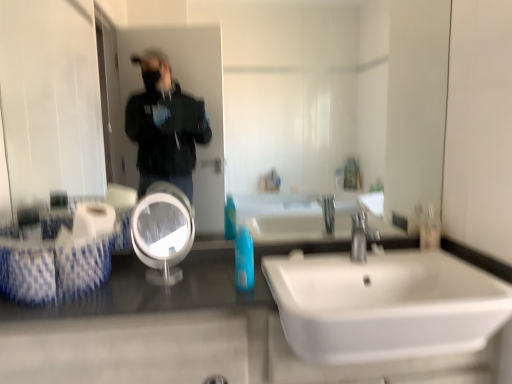
Question: From the image's perspective, does shiny granite counter at lower left appear higher than white ceramic sink at lower right?

Choices:
 (A) yes
 (B) no

Answer: (B)

Question: Is shiny granite counter at lower left positioned with its back to white ceramic sink at lower right?

Choices:
 (A) no
 (B) yes

Answer: (B)

Question: Is shiny granite counter at lower left thinner than white ceramic sink at lower right?

Choices:
 (A) no
 (B) yes

Answer: (B)

Question: From a real-world perspective, is shiny granite counter at lower left physically above white ceramic sink at lower right?

Choices:
 (A) no
 (B) yes

Answer: (A)

Question: Is white ceramic sink at lower right completely or partially inside shiny granite counter at lower left?

Choices:
 (A) yes
 (B) no

Answer: (A)

Question: Is shiny granite counter at lower left not inside white ceramic sink at lower right?

Choices:
 (A) no
 (B) yes

Answer: (B)

Question: Does shiny granite counter at lower left have a greater height compared to white glossy mirror at center?

Choices:
 (A) yes
 (B) no

Answer: (A)

Question: From the image's perspective, is shiny granite counter at lower left on top of white glossy mirror at center?

Choices:
 (A) yes
 (B) no

Answer: (B)

Question: Is shiny granite counter at lower left to the left of white glossy mirror at center from the viewer's perspective?

Choices:
 (A) no
 (B) yes

Answer: (A)

Question: From a real-world perspective, is shiny granite counter at lower left physically below white glossy mirror at center?

Choices:
 (A) yes
 (B) no

Answer: (A)

Question: Is shiny granite counter at lower left further to the viewer compared to white glossy mirror at center?

Choices:
 (A) yes
 (B) no

Answer: (B)

Question: Considering the relative positions of shiny granite counter at lower left and white glossy mirror at center in the image provided, is shiny granite counter at lower left to the right of white glossy mirror at center from the viewer's perspective?

Choices:
 (A) no
 (B) yes

Answer: (B)

Question: Can clear plastic bottle at right, which is the first mouthwash in right-to-left order, be found inside clear glass mirror at center?

Choices:
 (A) no
 (B) yes

Answer: (A)